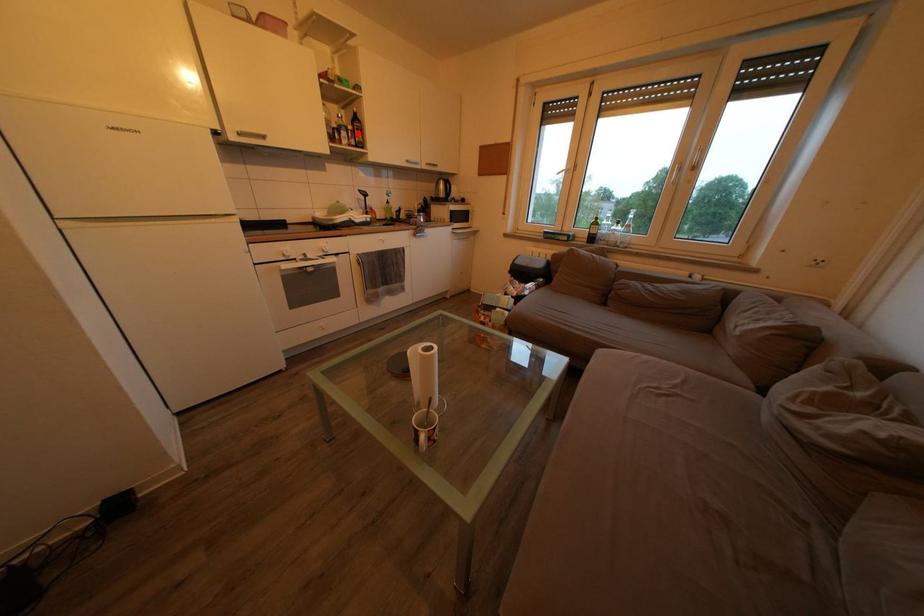
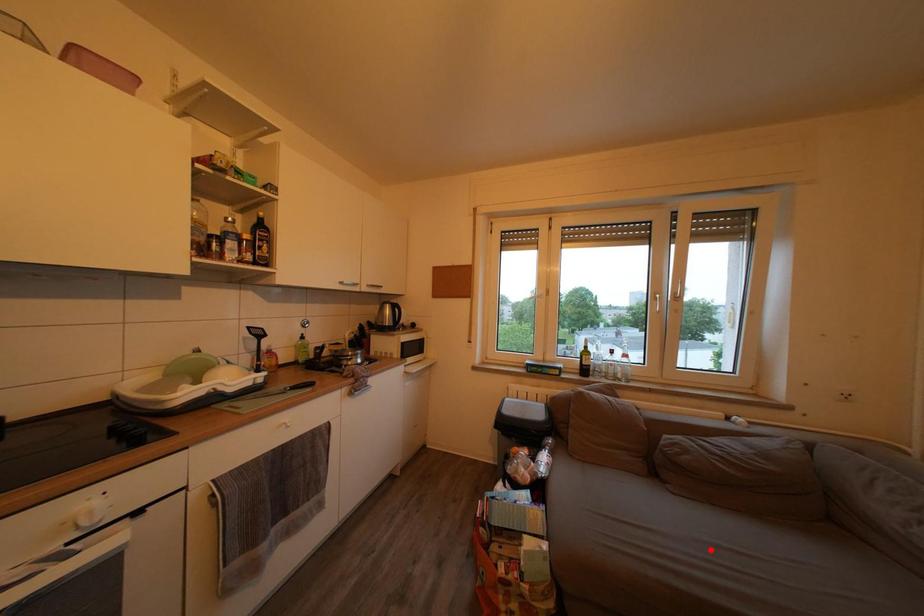
I am providing you with two images of the same scene from different viewpoints. A red point is marked on the first image and another point is marked on the second image. Is the marked point in image1 the same physical position as the marked point in image2?

No